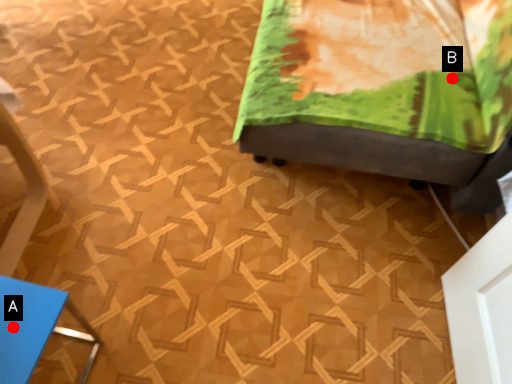
Question: Two points are circled on the image, labeled by A and B beside each circle. Which point is closer to the camera taking this photo?

Choices:
 (A) A is closer
 (B) B is closer

Answer: (A)